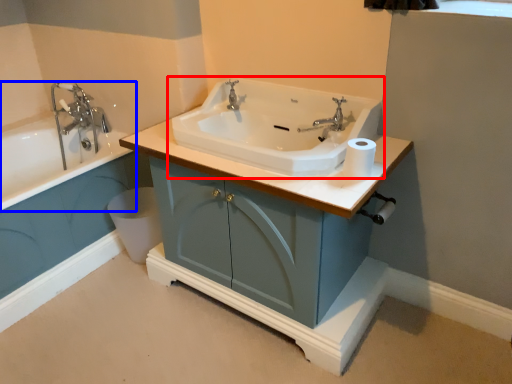
Question: Which object appears farthest to the camera in this image, sink (highlighted by a red box) or bathtub (highlighted by a blue box)?

Choices:
 (A) sink
 (B) bathtub

Answer: (B)